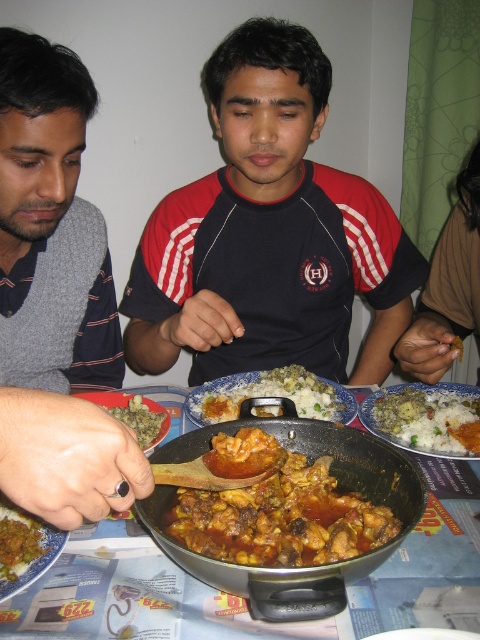
You are a photographer trying to capture a closeup shot of the brown matte rice at center. However, the matte black shirt at center is blocking your view. Can you estimate whether the rice will still be visible if you move your camera slightly to the right?

The matte black shirt at center is larger in size than brown matte rice at center. Moving the camera to the right might still allow partial visibility of the brown matte rice at center, but the shirt could still obstruct part of it depending on their positions.

You are a photographer trying to capture the central figure wearing a red and black sports jersey with white stripes on the sleeves and a logo on the chest. You want to position your camera so that the central figure is centered in the frame. Given that the central figure is at point (x=268, y=234), where should you aim your camera?

The central figure is at point (x=268, y=234). To center them in the frame, aim your camera directly at point (x=268, y=234).

You are sitting at the table and want to reach both the point at (168, 314) and the point at (267, 460). Which point should you reach for first to minimize the distance traveled?

You should reach for the point at (168, 314) first because it is closer to you than the point at (267, 460).